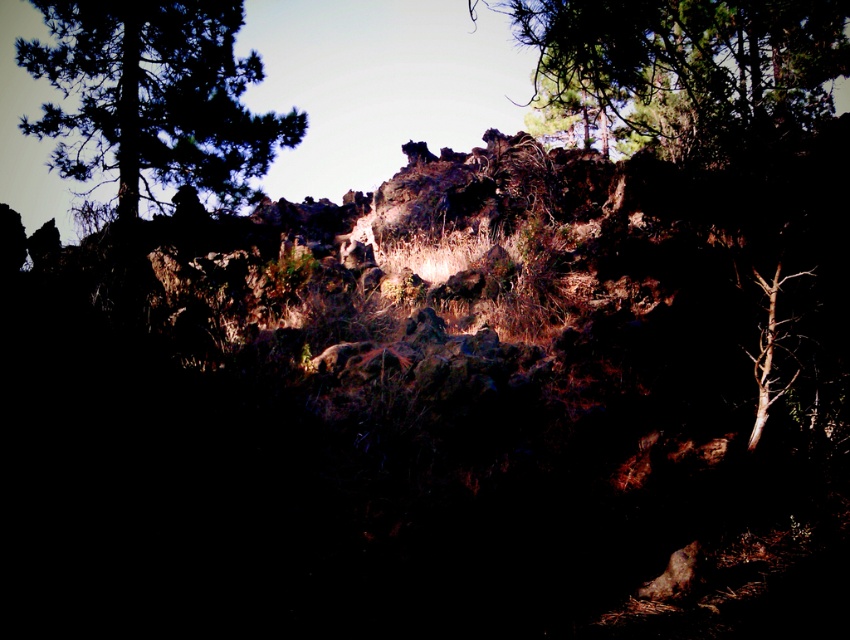
You are a hiker trying to navigate through this rugged landscape. You notice a brown textured tree at center and a green leafy tree at upper left. Which tree would block your view of the other tree if you were standing between them?

The brown textured tree at center is in front of the green leafy tree at upper left, so it would block your view of the green leafy tree at upper left.

You are standing in this rugged landscape and want to walk towards the brown textured tree at center and the green leafy tree at upper center. Which tree will you reach first?

You will reach the brown textured tree at center first because it is closer to you than the green leafy tree at upper center, which is further away.